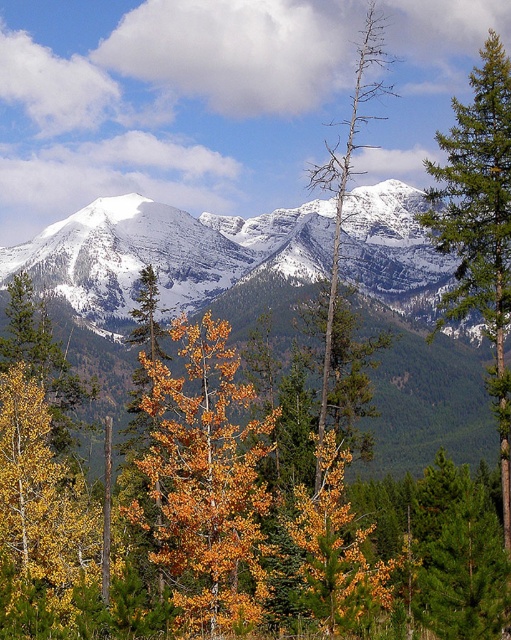
Imagine you are standing at the point labeled point (168, 252). Based on the scene description, what type of terrain are you most likely standing on?

The point (168, 252) is on snowy granite mountains at center, so you are most likely standing on a snowy mountain terrain.

In the mountainous landscape scene, where are the snowy granite mountains at center located?

The snowy granite mountains at center are located at point (168, 252).

You are standing at the point marked as point (239, 502) in the image. What object are you directly facing?

You are directly facing the yellow leafy tree at center located at point (239, 502).